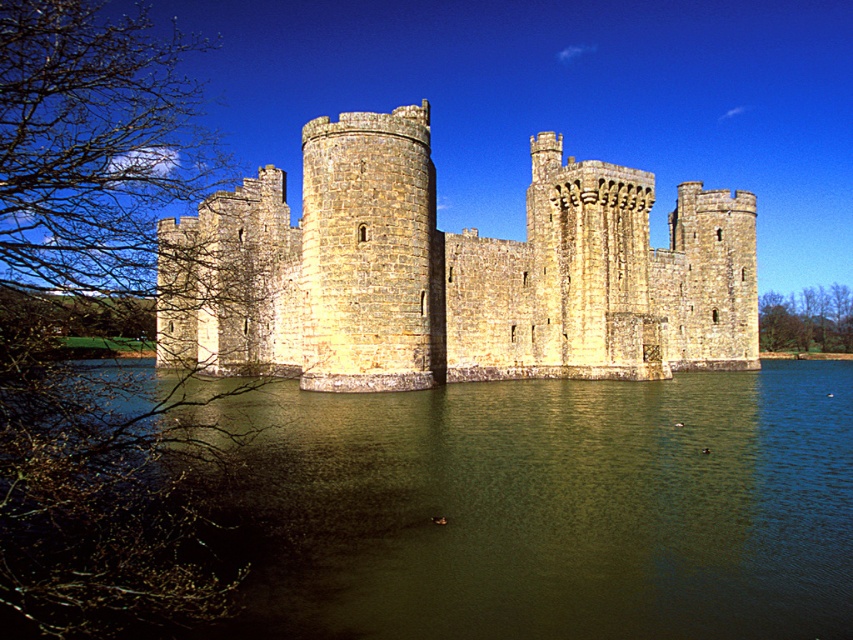
Does greenish water at center have a lesser width compared to stone castle at center?

Yes, greenish water at center is thinner than stone castle at center.

Measure the distance between greenish water at center and camera.

greenish water at center and camera are 114.75 feet apart from each other.

What do you see at coordinates (546, 508) in the screenshot? I see `greenish water at center` at bounding box center [546, 508].

Identify the location of greenish water at center. The image size is (853, 640). (546, 508).